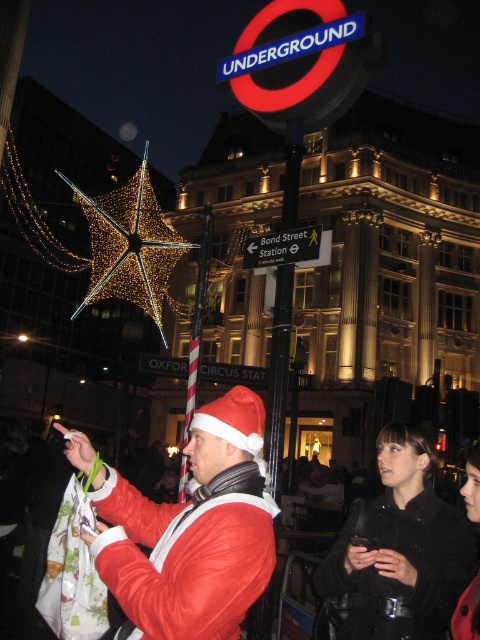
Question: Can you confirm if matte red santa hat at center is positioned to the right of black plastic sign at center?

Choices:
 (A) no
 (B) yes

Answer: (A)

Question: Which object is farther from the camera taking this photo?

Choices:
 (A) black plastic sign at center
 (B) matte red santa hat at center

Answer: (A)

Question: Can you confirm if matte red santa hat at center is smaller than black plastic sign at center?

Choices:
 (A) no
 (B) yes

Answer: (A)

Question: Which point is closer to the camera?

Choices:
 (A) matte red santa hat at center
 (B) black plastic sign at center

Answer: (A)

Question: Among these points, which one is farthest from the camera?

Choices:
 (A) (326, 243)
 (B) (253, 532)

Answer: (A)

Question: Can you confirm if matte red santa hat at center is bigger than black plastic sign at center?

Choices:
 (A) yes
 (B) no

Answer: (A)